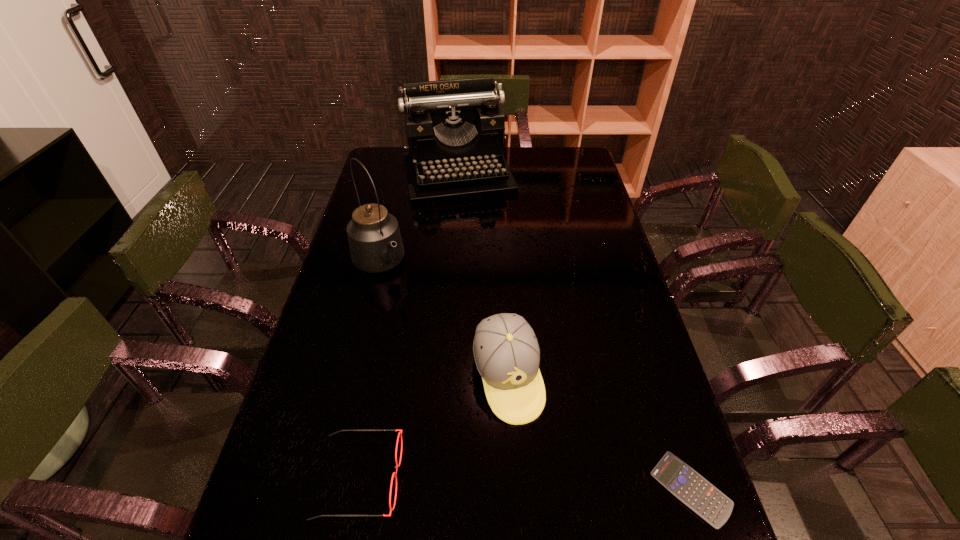
In the image, there is a desktop. Identify the location of free space at the left edge. Image resolution: width=960 pixels, height=540 pixels. (340, 441).

Find the location of a particular element. This screenshot has width=960, height=540. free location at the right edge is located at coordinates (628, 471).

In the image, there is a desktop. At what (x,y) coordinates should I click in order to perform the action: click on free region at the far left corner. Please return your answer as a coordinate pair (x, y). Looking at the image, I should click on (396, 163).

This screenshot has width=960, height=540. Identify the location of vacant space at the far right corner of the desktop. (563, 157).

The width and height of the screenshot is (960, 540). In order to click on vacant space that's between the third shortest object and the typewriter in this screenshot , I will do point(483,276).

The image size is (960, 540). Find the location of `free space between the typewriter and the fourth tallest object`. free space between the typewriter and the fourth tallest object is located at coordinates (409, 326).

At what (x,y) coordinates should I click in order to perform the action: click on vacant space that is in between the fourth tallest object and the calculator. Please return your answer as a coordinate pair (x, y). Looking at the image, I should click on (525, 483).

What are the coordinates of `empty space that is in between the third shortest object and the calculator` in the screenshot? It's located at coord(599,433).

I want to click on unoccupied position between the third farthest object and the typewriter, so click(483, 276).

Locate an element on the screen. The width and height of the screenshot is (960, 540). empty space between the spectacles and the typewriter is located at coordinates (409, 326).